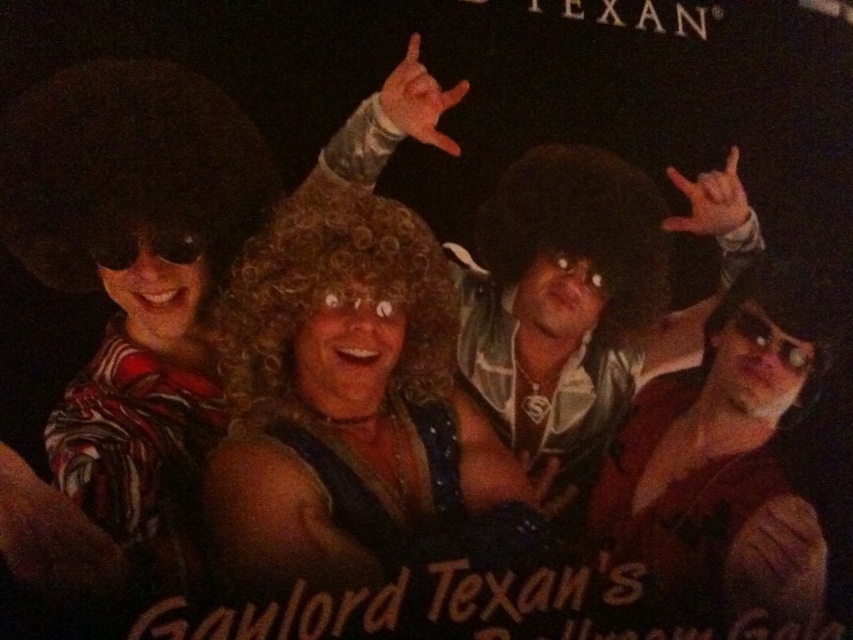
You are a photographer trying to adjust the lighting for a group photo. You notice the curly blonde wig at center and the shiny brown leather jacket at right. Which object is located to the left of the other?

The curly blonde wig at center is positioned on the left side of the shiny brown leather jacket at right.

You are a photographer trying to capture a group photo of the curly blonde wig at center and the shiny brown leather jacket at right. Since you want to ensure both subjects are in focus, you need to know which object is bigger. Which one is larger?

The curly blonde wig at center has a larger size compared to the shiny brown leather jacket at right, so you should focus on the curly blonde wig at center first as it is bigger.

You are a photographer trying to capture a group photo of the curly blonde wig at center and the shiny brown leather jacket at right. Since you want to ensure both subjects are in focus, you need to know which one is wider to adjust your camera settings accordingly. Which object is wider?

The curly blonde wig at center is wider than the shiny brown leather jacket at right according to the description, so you should adjust your camera settings to accommodate its width.